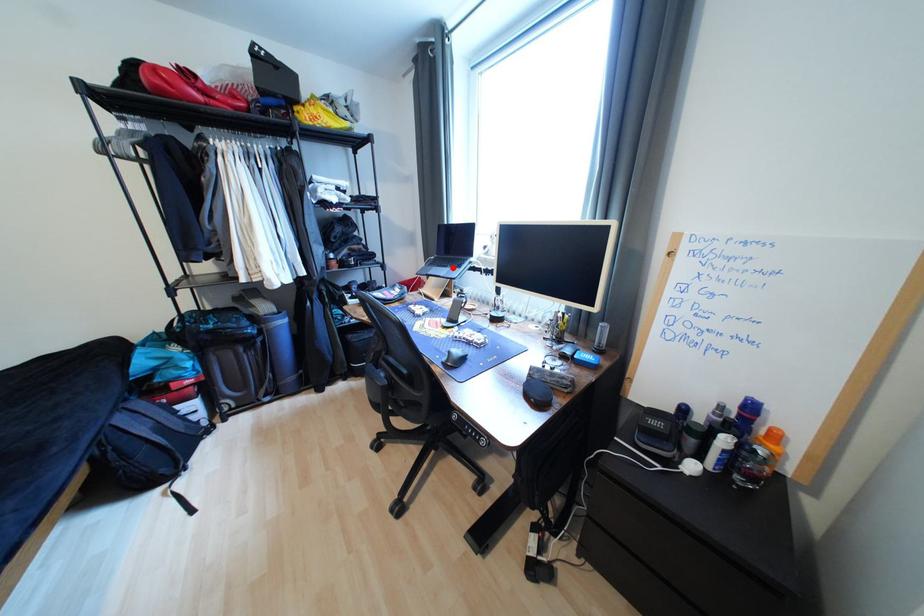
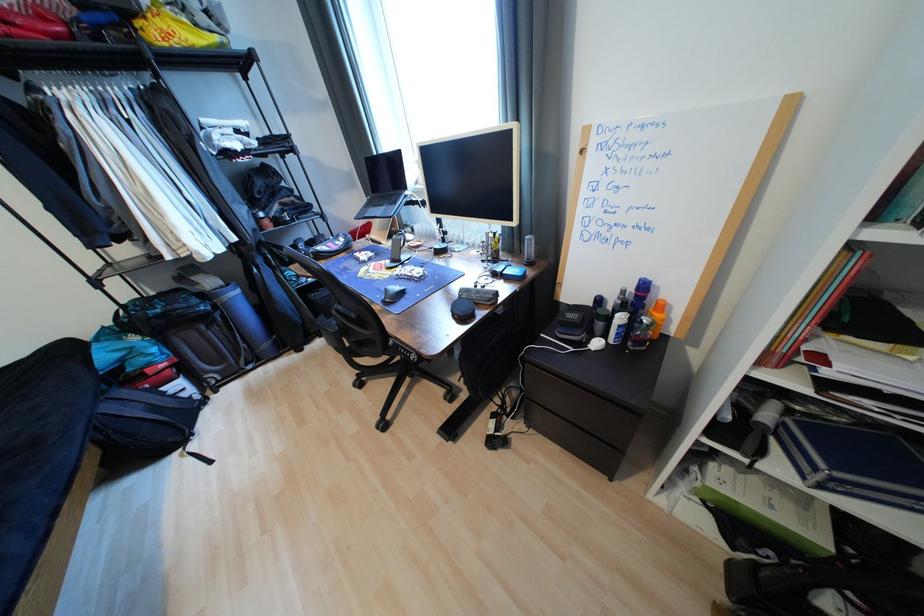
Question: I am providing you with two images of the same scene from different viewpoints. Given a red point in image1, look at the same physical point in image2. Is it:

Choices:
 (A) Closer to the viewpoint
 (B) Farther from the viewpoint

Answer: (A)